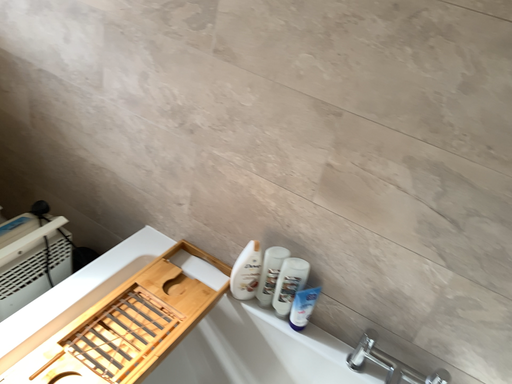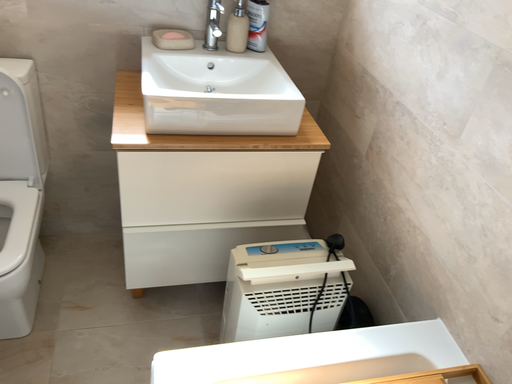
Question: Which way did the camera rotate in the video?

Choices:
 (A) rotated downward
 (B) rotated upward

Answer: (B)